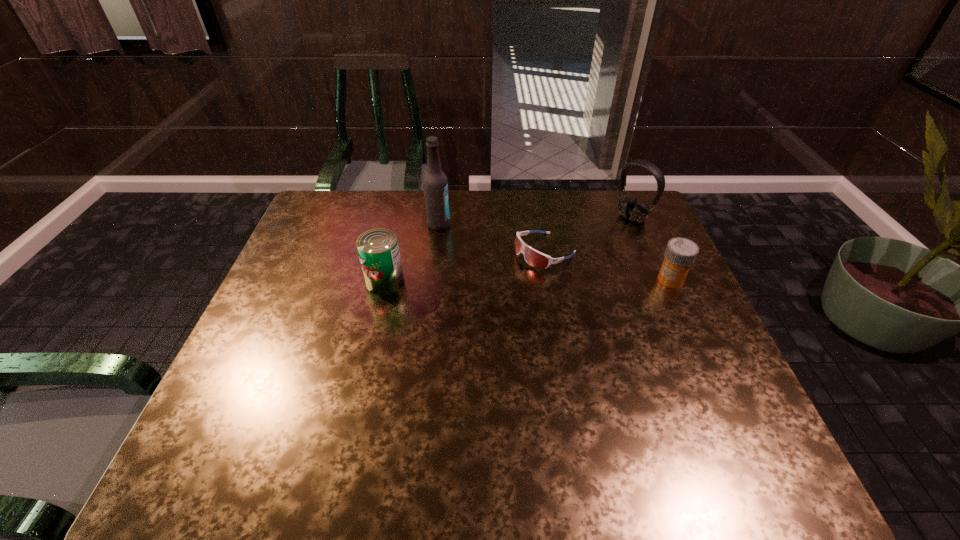
The width and height of the screenshot is (960, 540). I want to click on vacant space at the far left corner of the desktop, so click(310, 222).

You are a GUI agent. You are given a task and a screenshot of the screen. Output one action in this format:
    pyautogui.click(x=<x>, y=<y>)
    Task: Click on the vacant space at the far right corner of the desktop
    
    Given the screenshot: What is the action you would take?
    pyautogui.click(x=603, y=200)

This screenshot has width=960, height=540. I want to click on empty space that is in between the goggles and the second shortest object, so click(x=608, y=266).

You are a GUI agent. You are given a task and a screenshot of the screen. Output one action in this format:
    pyautogui.click(x=<x>, y=<y>)
    Task: Click on the empty space between the second tallest object and the fourth tallest object
    
    Given the screenshot: What is the action you would take?
    pyautogui.click(x=651, y=249)

Locate an element on the screen. This screenshot has width=960, height=540. vacant area between the medicine and the leftmost object is located at coordinates (528, 280).

Identify the location of free space between the headset and the goggles. (588, 235).

Locate an element on the screen. vacant point located between the second object from left to right and the medicine is located at coordinates (555, 252).

Identify the location of blank region between the tallest object and the shortest object. The width and height of the screenshot is (960, 540). (492, 238).

Image resolution: width=960 pixels, height=540 pixels. What are the coordinates of `unoccupied area between the fourth tallest object and the can` in the screenshot? It's located at (528, 280).

This screenshot has height=540, width=960. I want to click on vacant space in between the second shortest object and the third object from left to right, so click(x=608, y=266).